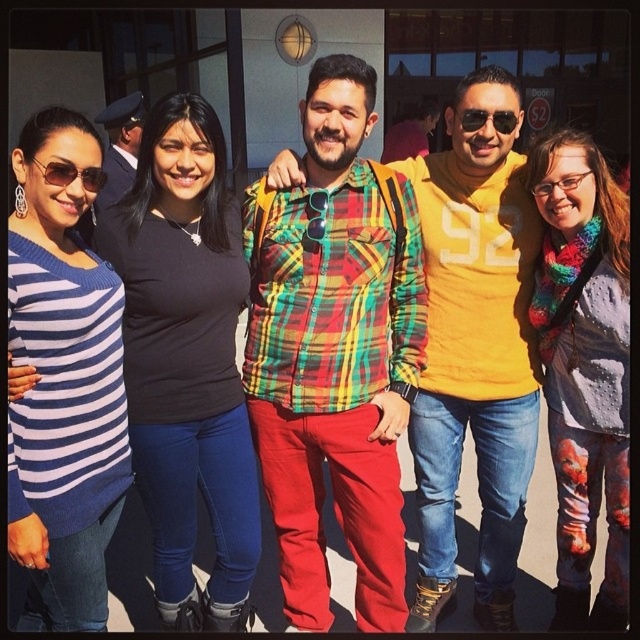
Question: Is multicolored plaid shirt at center below knitted scarf at center?

Choices:
 (A) yes
 (B) no

Answer: (B)

Question: Considering the real-world distances, which object is closest to the blue and white striped sweater at left?

Choices:
 (A) black matte shirt at center
 (B) multicolored plaid shirt at center
 (C) sunglasses at center
 (D) sunglasses at left

Answer: (A)

Question: Which of these objects is positioned farthest from the black matte shirt at center?

Choices:
 (A) sunglasses at center
 (B) blue and white striped sweater at left

Answer: (A)

Question: Which of the following is the farthest from the observer?

Choices:
 (A) (243, 483)
 (B) (90, 168)
 (C) (467, 116)
 (D) (275, 195)

Answer: (D)

Question: Can you confirm if sunglasses at left is positioned to the left of sunglasses at center?

Choices:
 (A) no
 (B) yes

Answer: (B)

Question: Is multicolored plaid shirt at center positioned before knitted scarf at center?

Choices:
 (A) no
 (B) yes

Answer: (B)